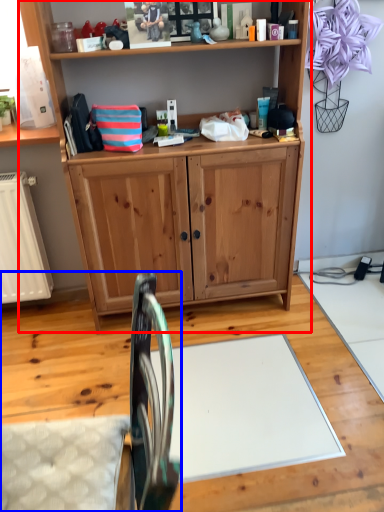
Question: Which of the following is the farthest to the observer, vanity (highlighted by a red box) or swivel chair (highlighted by a blue box)?

Choices:
 (A) vanity
 (B) swivel chair

Answer: (A)